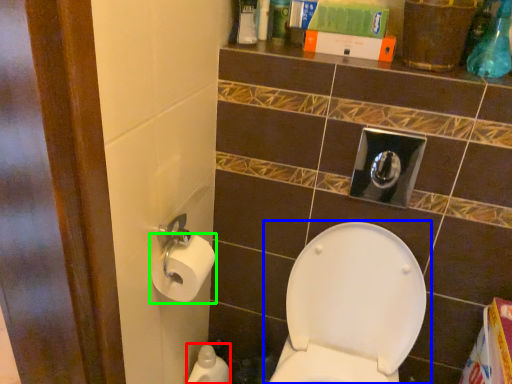
Question: Considering the real-world distances, which object is closest to cleaning product (highlighted by a red box)? toilet (highlighted by a blue box) or toiletry (highlighted by a green box).

Choices:
 (A) toilet
 (B) toiletry

Answer: (A)